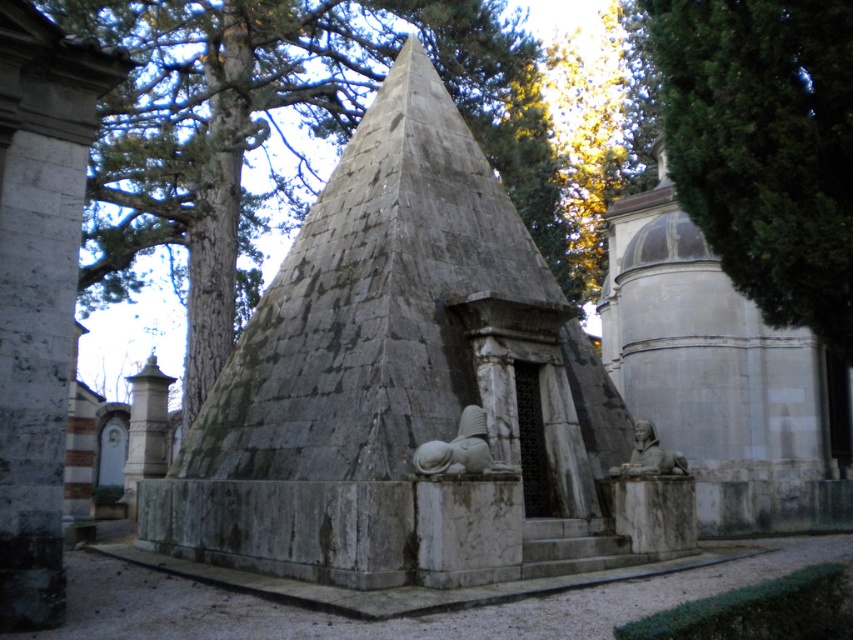
You are standing at the entrance of the monument and want to take a photo of the gray stone pyramid at center. Where should you position yourself to capture it in the frame?

You should position yourself at the entrance of the monument, as the gray stone pyramid at center is located at point [410,388], which would be within your camera frame from that vantage point.

In the scene shown: You are an archaeologist standing at the entrance of the gray stone pyramid at center. You notice a gray stone sphinx at lower right nearby. Based on the structure of the pyramid and the sphinx, which object would you estimate has a larger base width?

The gray stone pyramid at center might be wider than the gray stone sphinx at lower right, so the pyramid likely has a larger base width.